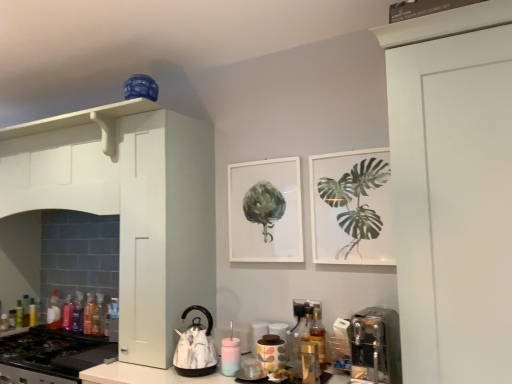
Based on the photo, measure the distance between translucent plastic bottle at lower left, the second bottle viewed from the left, and camera.

translucent plastic bottle at lower left, the second bottle viewed from the left, is 2.75 meters away from camera.

What do you see at coordinates (89, 314) in the screenshot?
I see `translucent plastic bottle at lower left, the 3th bottle viewed from the right` at bounding box center [89, 314].

Measure the distance between translucent plastic bottle at lower left, the 3th bottle from the front, and camera.

translucent plastic bottle at lower left, the 3th bottle from the front, is 8.51 feet away from camera.

What do you see at coordinates (68, 313) in the screenshot? This screenshot has width=512, height=384. I see `translucent plastic bottle at lower left, marked as the 5th bottle in a front-to-back arrangement` at bounding box center [68, 313].

This screenshot has width=512, height=384. What do you see at coordinates (258, 333) in the screenshot? I see `matte ceramic mug at center, the second appliance positioned from the right` at bounding box center [258, 333].

The height and width of the screenshot is (384, 512). What are the coordinates of `translucent plastic bottle at lower left, the second bottle viewed from the left` in the screenshot? It's located at (26, 311).

Is translucent plastic bottle at lower left, the 5th bottle positioned from the left, facing away from white matte cabinet at left?

No, translucent plastic bottle at lower left, the 5th bottle positioned from the left, is not facing away from white matte cabinet at left.

Which is behind, translucent plastic bottle at lower left, which is the 5th bottle from back to front, or white matte cabinet at left?

translucent plastic bottle at lower left, which is the 5th bottle from back to front, is further from the camera.

Is translucent plastic bottle at lower left, the 5th bottle positioned from the left, wider than white matte cabinet at left?

In fact, translucent plastic bottle at lower left, the 5th bottle positioned from the left, might be narrower than white matte cabinet at left.

Is translucent plastic bottle at lower left, which ranks as the 9th bottle in right-to-left order, wider than translucent plastic bottle at left, the sixth bottle from the right?

In fact, translucent plastic bottle at lower left, which ranks as the 9th bottle in right-to-left order, might be narrower than translucent plastic bottle at left, the sixth bottle from the right.

Could you tell me if translucent plastic bottle at lower left, the first bottle in the left-to-right sequence, is turned towards translucent plastic bottle at left, which ranks as the 4th bottle in left-to-right order?

No.

Is point (15, 315) positioned behind point (49, 308)?

No, it is in front of (49, 308).

Which of these two, translucent plastic bottle at lower left, which is the 3th bottle from back to front, or translucent plastic bottle at left, which is the sixth bottle from front to back, stands taller?

translucent plastic bottle at left, which is the sixth bottle from front to back, is taller.

Considering the sizes of objects translucent plastic bottles at left, the fourth bottle when ordered from front to back, and green leafy plant at upper right in the image provided, who is taller, translucent plastic bottles at left, the fourth bottle when ordered from front to back, or green leafy plant at upper right?

With more height is green leafy plant at upper right.

Is translucent plastic bottles at left, the 4th bottle in the right-to-left sequence, closer to camera compared to green leafy plant at upper right?

No, it is behind green leafy plant at upper right.

In the scene shown: Which is closer to the camera, (77, 312) or (342, 256)?

Clearly, point (77, 312) is more distant from the camera than point (342, 256).

From the image's perspective, which is above, translucent plastic bottles at left, the 4th bottle in the right-to-left sequence, or green leafy plant at upper right?

From the image's view, green leafy plant at upper right is above.

Is translucent plastic bottle at lower left, marked as the eighth bottle in a front-to-back arrangement, surrounded by translucent plastic bottle at left, the sixth bottle from the right?

No, translucent plastic bottle at lower left, marked as the eighth bottle in a front-to-back arrangement, is not inside translucent plastic bottle at left, the sixth bottle from the right.

How different are the orientations of translucent plastic bottle at left, which appears as the fourth bottle when viewed from the back, and translucent plastic bottle at lower left, the eighth bottle from the right, in degrees?

There is a 89.6-degree angle between the facing directions of translucent plastic bottle at left, which appears as the fourth bottle when viewed from the back, and translucent plastic bottle at lower left, the eighth bottle from the right.

Looking at this image, can you confirm if translucent plastic bottle at left, which is the sixth bottle from front to back, is taller than translucent plastic bottle at lower left, marked as the eighth bottle in a front-to-back arrangement?

Yes.

Considering the positions of objects translucent plastic bottle at left, the sixth bottle from the right, and translucent plastic bottle at lower left, the eighth bottle from the right, in the image provided, who is more to the left, translucent plastic bottle at left, the sixth bottle from the right, or translucent plastic bottle at lower left, the eighth bottle from the right,?

Positioned to the left is translucent plastic bottle at lower left, the eighth bottle from the right.

How different are the orientations of matte ceramic mug at center, arranged as the 2th appliance when viewed from the left, and matte ceramic jar at lower center, placed as the third appliance when sorted from left to right, in degrees?

The facing directions of matte ceramic mug at center, arranged as the 2th appliance when viewed from the left, and matte ceramic jar at lower center, placed as the third appliance when sorted from left to right, are 0.14 degrees apart.

From the picture: Is matte ceramic mug at center, arranged as the 2th appliance when viewed from the left, looking in the opposite direction of matte ceramic jar at lower center, positioned as the 1th appliance in right-to-left order?

That's not correct — matte ceramic mug at center, arranged as the 2th appliance when viewed from the left, is not looking away from matte ceramic jar at lower center, positioned as the 1th appliance in right-to-left order.

From a real-world perspective, between matte ceramic mug at center, the second appliance positioned from the right, and matte ceramic jar at lower center, placed as the third appliance when sorted from left to right, who is vertically higher?

Result: From a 3D spatial view, matte ceramic mug at center, the second appliance positioned from the right, is above.

Image resolution: width=512 pixels, height=384 pixels. In the image, there is a matte ceramic mug at center, arranged as the 2th appliance when viewed from the left. Identify the location of appliance below it (from a real-world perspective). (271, 352).

Is translucent plastic bottle at lower left, which is the second bottle from front to back, oriented away from translucent plastic bottles at left, the sixth bottle positioned from the left?

No, translucent plastic bottle at lower left, which is the second bottle from front to back, is not facing away from translucent plastic bottles at left, the sixth bottle positioned from the left.

From the picture: Which of these two, translucent plastic bottle at lower left, the 2th bottle when ordered from right to left, or translucent plastic bottles at left, the sixth bottle positioned from the left, stands shorter?

translucent plastic bottles at left, the sixth bottle positioned from the left, is shorter.

From a real-world perspective, which object rests below the other?

From a 3D spatial view, translucent plastic bottle at lower left, the eighth bottle positioned from the back, is below.

Can you confirm if translucent plastic bottle at lower left, the 2th bottle when ordered from right to left, is smaller than translucent plastic bottles at left, the 4th bottle in the right-to-left sequence?

Yes.

Between matte white frame at center and translucent glass bottle at lower center, which is the first bottle from right to left, which one has more height?

matte white frame at center is taller.

Is point (237, 226) more distant than point (313, 339)?

Yes, it is.

Could translucent glass bottle at lower center, which is counted as the first bottle, starting from the front, be considered to be inside matte white frame at center?

No, translucent glass bottle at lower center, which is counted as the first bottle, starting from the front, is not surrounded by matte white frame at center.

Is the depth of matte white frame at center greater than that of translucent glass bottle at lower center, marked as the 9th bottle in a back-to-front arrangement?

That is True.

The height and width of the screenshot is (384, 512). In order to click on cabinetry lying on the right of translucent plastic bottle at lower left, the 5th bottle positioned from the left in this screenshot , I will do `click(163, 230)`.

In order to click on bottle that is the 2nd one when counting upward from the translucent plastic bottle at lower left, which is the 3th bottle from back to front (from the image's perspective) in this screenshot , I will do `click(54, 313)`.

Based on their spatial positions, is satin silver coffee machine at lower right or matte white frame at center closer to green leafy plant at upper right?

matte white frame at center is positioned closer to the anchor green leafy plant at upper right.

When comparing their distances from green leafy plant at upper right, does translucent plastic bottle at lower left, the 5th bottle positioned from the left, or matte ceramic mug at center, arranged as the 2th appliance when viewed from the left, seem closer?

matte ceramic mug at center, arranged as the 2th appliance when viewed from the left, is positioned closer to the anchor green leafy plant at upper right.

When comparing their distances from translucent plastic bottle at left, which appears as the fourth bottle when viewed from the back, does green leafy plant at upper right or translucent glass bottle at lower center, the 9th bottle viewed from the left, seem further?

green leafy plant at upper right is positioned further to the anchor translucent plastic bottle at left, which appears as the fourth bottle when viewed from the back.

Looking at the image, which one is located closer to translucent plastic bottle at lower left, which ranks as the 9th bottle in right-to-left order, translucent plastic bottles at left, the sixth bottle positioned from the left, or matte ceramic mug at center, the second appliance positioned from the right?

translucent plastic bottles at left, the sixth bottle positioned from the left.

When comparing their distances from translucent plastic bottle at lower left, the second bottle viewed from the left, does black matte gas stove at lower left or translucent plastic bottle at lower left, which is the 7th bottle from front to back, seem closer?

translucent plastic bottle at lower left, which is the 7th bottle from front to back, lies closer to translucent plastic bottle at lower left, the second bottle viewed from the left, than the other object.

Based on their spatial positions, is matte white frame at center or translucent plastic bottle at lower left, acting as the seventh bottle starting from the left, closer to black matte gas stove at lower left?

translucent plastic bottle at lower left, acting as the seventh bottle starting from the left, lies closer to black matte gas stove at lower left than the other object.

Estimate the real-world distances between objects in this image. Which object is closer to translucent plastic bottle at lower left, the first bottle in the left-to-right sequence, translucent plastic bottle at lower left, which ranks as the 2th bottle in back-to-front order, or translucent plastic bottle at left, which is the sixth bottle from front to back?

Based on the image, translucent plastic bottle at lower left, which ranks as the 2th bottle in back-to-front order, appears to be nearer to translucent plastic bottle at lower left, the first bottle in the left-to-right sequence.

Considering their positions, is green leafy plant at upper right positioned closer to white glossy kettle at lower center, which is the 1th appliance in left-to-right order, than white matte cabinet at left?

Among the two, white matte cabinet at left is located nearer to white glossy kettle at lower center, which is the 1th appliance in left-to-right order.

I want to click on picture frame between black matte gas stove at lower left and green leafy plant at upper right, so click(x=260, y=224).

Where is `picture frame between white matte cabinet at left and translucent glass bottle at lower center, which is the first bottle from right to left`? Image resolution: width=512 pixels, height=384 pixels. picture frame between white matte cabinet at left and translucent glass bottle at lower center, which is the first bottle from right to left is located at coordinates (260, 224).

This screenshot has width=512, height=384. I want to click on cabinetry between translucent plastic bottle at left, which is the sixth bottle from front to back, and translucent glass bottle at lower center, which is counted as the first bottle, starting from the front, from left to right, so (x=163, y=230).

Identify the location of appliance located between translucent plastic bottle at lower left, acting as the seventh bottle starting from the left, and matte ceramic mug at center, arranged as the 2th appliance when viewed from the left, in the left-right direction. This screenshot has width=512, height=384. (195, 347).